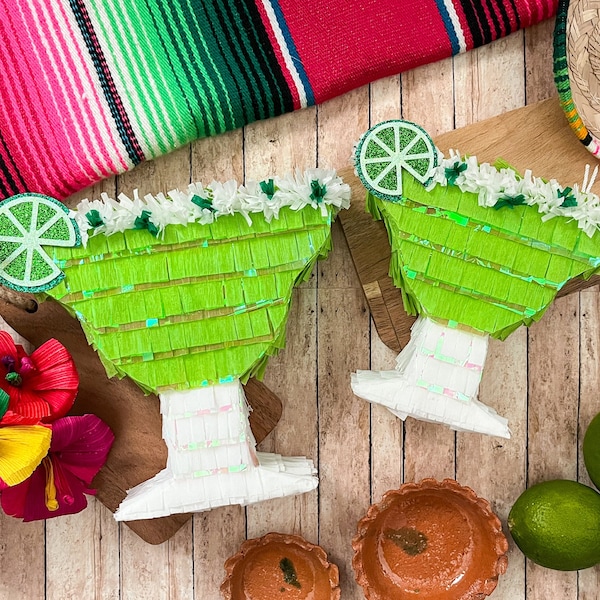
This screenshot has width=600, height=600. I want to click on wooden surface in background, so click(x=312, y=404).